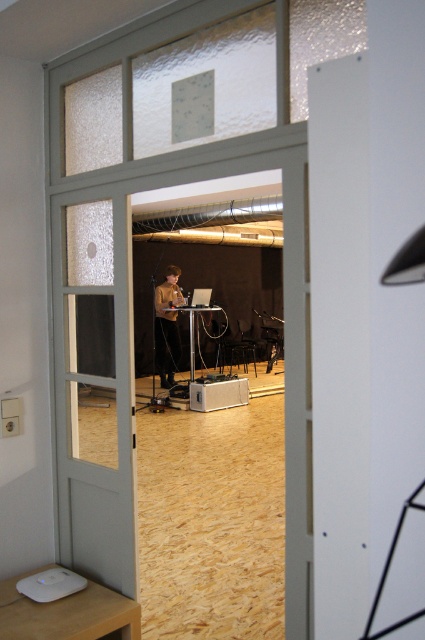
You are trying to see through the clear glass door at center to observe the matte brown sweater at center. Can you see the sweater through the door?

The clear glass door at center is above matte brown sweater at center, so yes, you can see the matte brown sweater at center through the door since it is positioned below the door.

Looking at this image, you are trying to pass through the clear glass door at center while wearing the matte brown sweater at center. Will the sweater fit through the door without needing to be folded or adjusted?

The clear glass door at center is wider than the matte brown sweater at center, so the sweater will fit through the door without needing to be folded or adjusted.